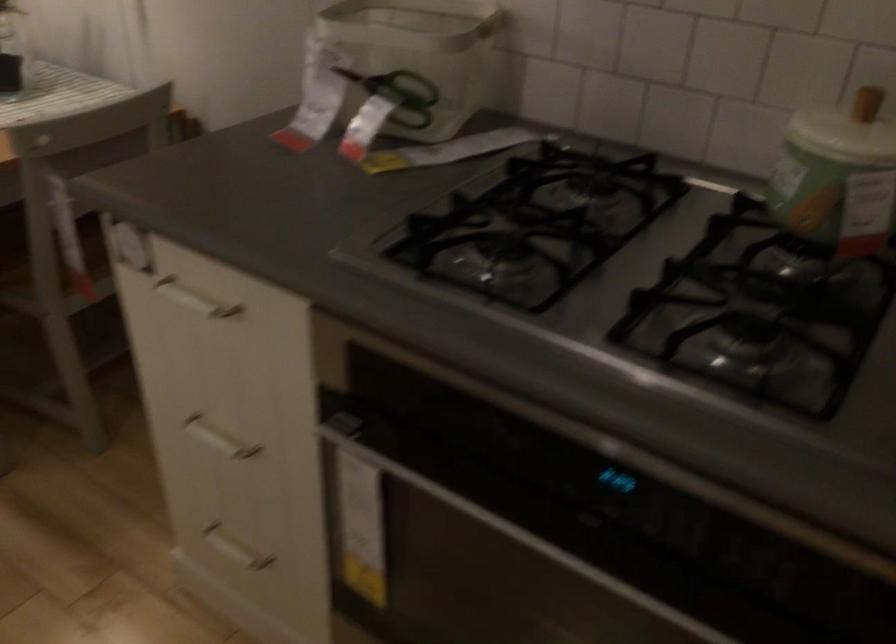
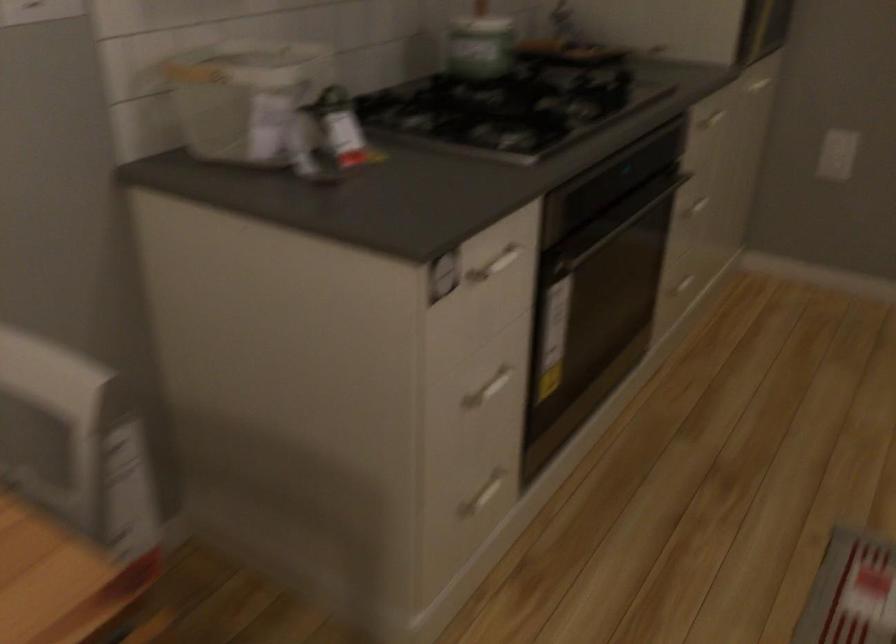
Where in the second image is the point corresponding to point 260,453 from the first image?

(487, 389)